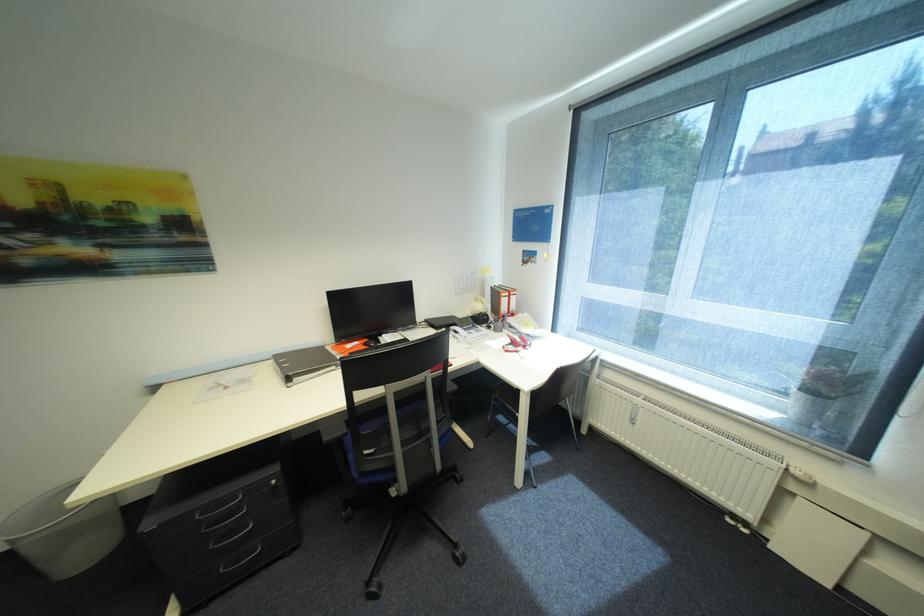
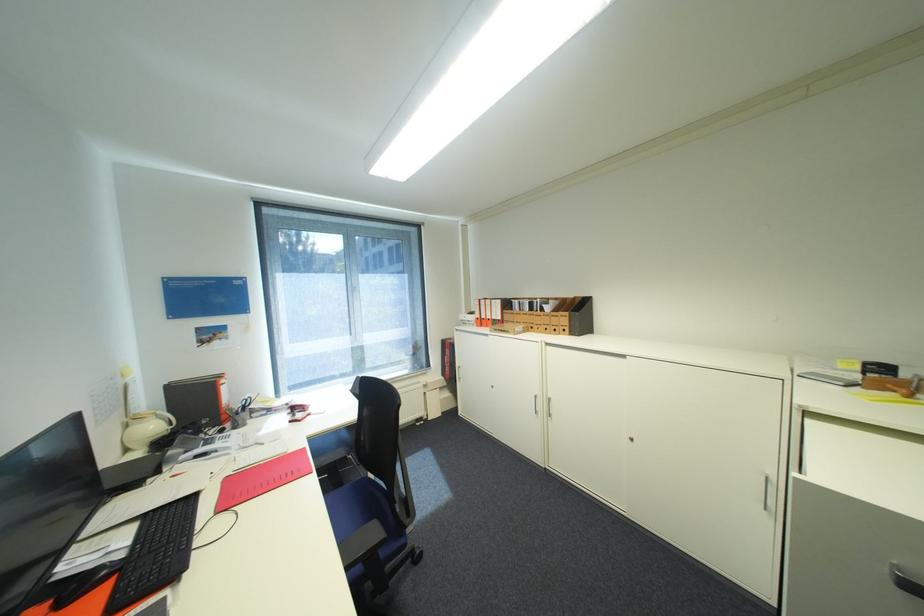
In the second image, find the point that corresponds to [488,307] in the first image.

(161, 427)